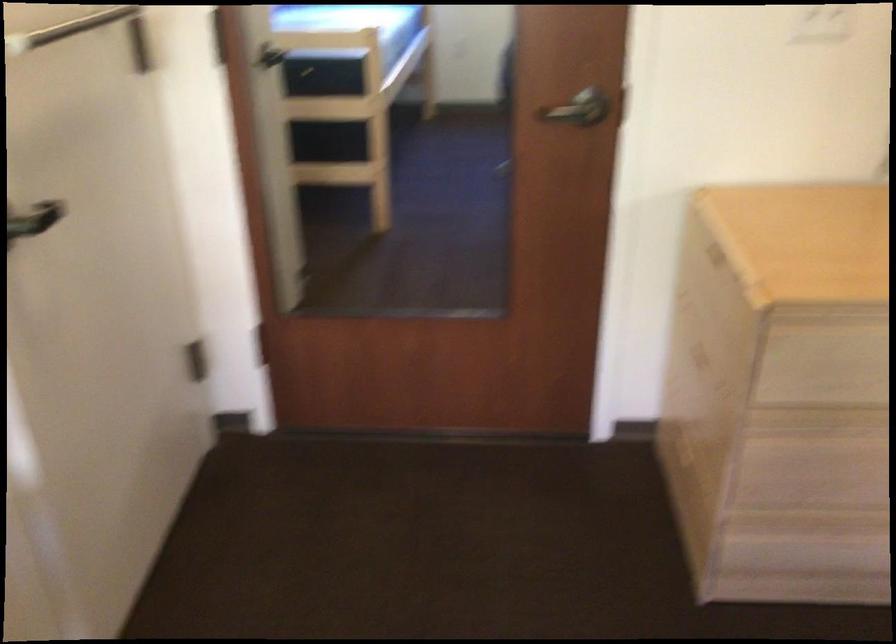
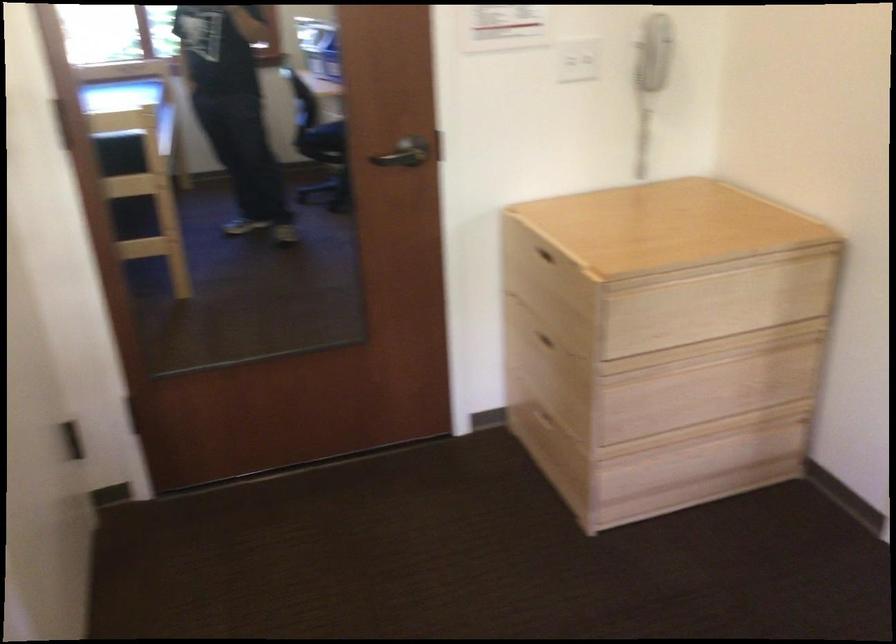
The images are taken continuously from a first-person perspective. In which direction are you moving?

The cameraman moved toward left, backward.